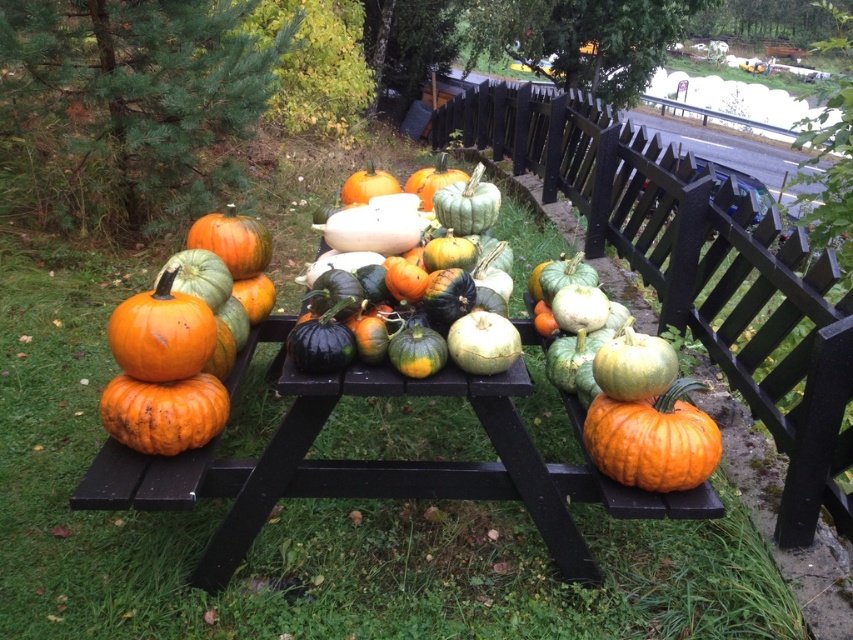
You are standing at the center of the image and want to locate the black wood fence at center. What coordinates should you look at?

The black wood fence at center is located at coordinates point (694, 269).

You are planning to take a photo of the black wood fence at center and the green matte gourds at center from a distance. Which object will appear taller in the photo?

The black wood fence at center will appear taller in the photo because it has a greater height compared to the green matte gourds at center.

You are standing at the edge of the grassy area near the black wooden picnic table. You want to walk to the road in the background. Which direction should you walk to avoid the black wood fence at center?

Since the black wood fence at center is positioned at point coordinates, you should walk around it either to the left or right to reach the road without obstruction.